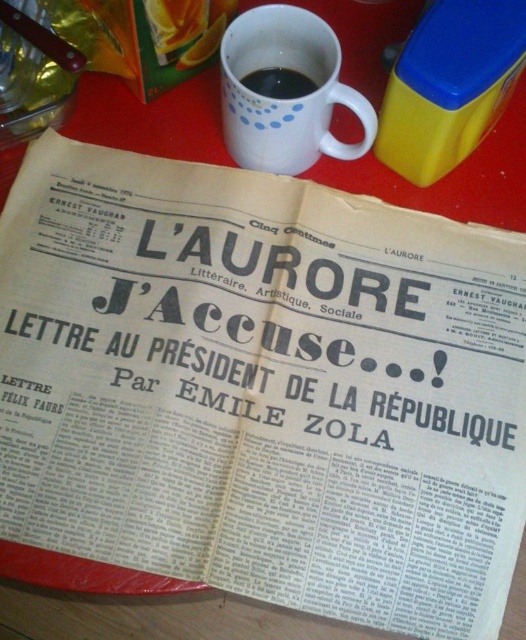
Is white matte mug at upper center thinner than black matte mug at upper center?

Incorrect, white matte mug at upper center's width is not less than black matte mug at upper center's.

I want to click on white matte mug at upper center, so click(x=286, y=99).

Identify the location of white matte mug at upper center. This screenshot has height=640, width=526. (286, 99).